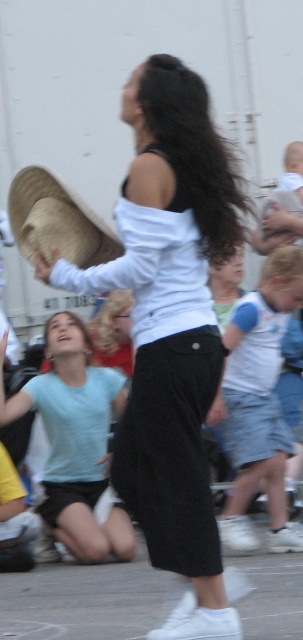
Can you confirm if white matte shirt at center is positioned to the left of brown straw hat at left?

In fact, white matte shirt at center is to the right of brown straw hat at left.

Can you confirm if white matte shirt at center is positioned below brown straw hat at left?

Yes, white matte shirt at center is below brown straw hat at left.

Is point (172, 269) positioned in front of point (85, 218)?

Yes, it is.

Find the location of a particular element. This screenshot has height=640, width=303. white matte shirt at center is located at coordinates (170, 330).

Is white matte shirt at center in front of light blue t-shirt at lower left?

That is True.

Who is positioned more to the right, white matte shirt at center or light blue t-shirt at lower left?

Positioned to the right is white matte shirt at center.

At what (x,y) coordinates should I click in order to perform the action: click on white matte shirt at center. Please return your answer as a coordinate pair (x, y). Image resolution: width=303 pixels, height=640 pixels. Looking at the image, I should click on (170, 330).

Measure the distance between point [72,492] and camera.

Point [72,492] is 6.06 meters away from camera.

Can you confirm if light blue t-shirt at lower left is positioned to the right of denim skirt at lower right?

In fact, light blue t-shirt at lower left is to the left of denim skirt at lower right.

Is point (106, 540) more distant than point (242, 348)?

Yes, point (106, 540) is behind point (242, 348).

This screenshot has width=303, height=640. What are the coordinates of `light blue t-shirt at lower left` in the screenshot? It's located at (75, 440).